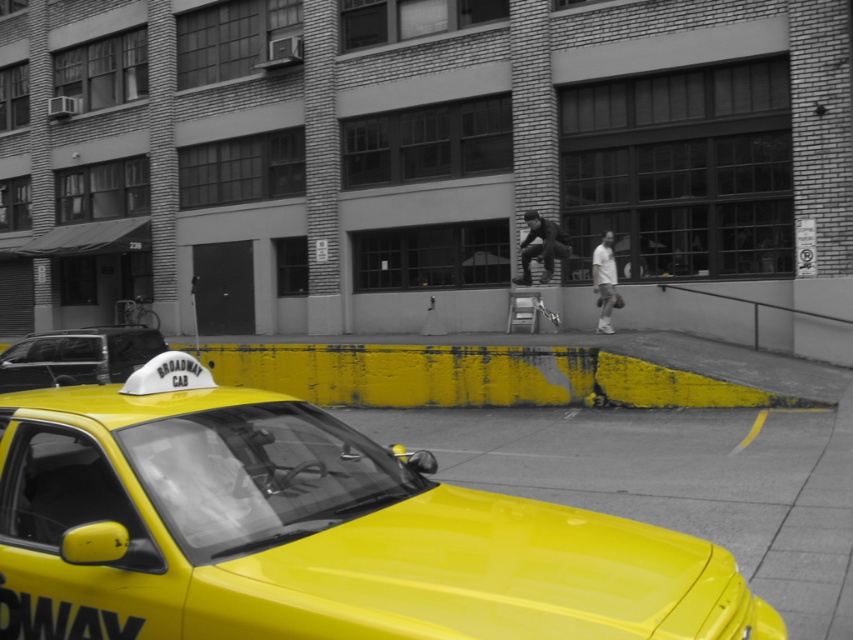
You are a photographer who wants to capture both the shiny yellow taxi at lower left and the yellow plastic taxi cab at lower left in the same frame. However, you notice that one of them is larger than the other. Which taxi should you focus on to ensure both are clearly visible in the photo?

The shiny yellow taxi at lower left is bigger than the yellow plastic taxi cab at lower left. To ensure both are clearly visible, focus on the smaller yellow plastic taxi cab at lower left so that the larger one doesn not overpower the frame.

You are a delivery person carrying a package and need to walk from the shiny yellow taxi at lower left to the dark gray fabric pants at center. The path is clear except for a small puddle that is 1.2 meters wide. Can you navigate around it without deviating more than 2 meters from the straight path between the two points?

The distance between the shiny yellow taxi at lower left and the dark gray fabric pants at center is 12.80 meters. The puddle is 1.2 meters wide. To navigate around it without deviating more than 2 meters from the straight path, you can detour around the puddle by moving sideways within the 2 meters limit, as the total required deviation is less than the allowed 2 meters. Therefore, it is possible to navigate around the puddle while staying within the 2 meters deviation limit.

You are a tailor measuring a customer for a suit. You notice the dark gray fabric pants at center and the white matte shirt at center. How far apart are these two items on the customer?

The dark gray fabric pants at center and white matte shirt at center are 33.00 inches apart from each other.